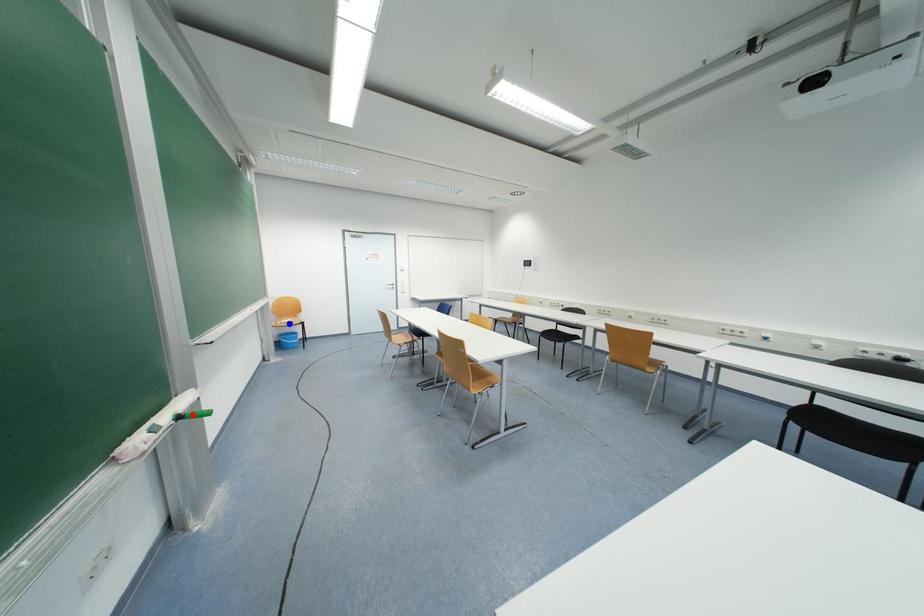
Question: Which of the two points in the image is closer to the camera?

Choices:
 (A) Blue point is closer.
 (B) Red point is closer.

Answer: (B)